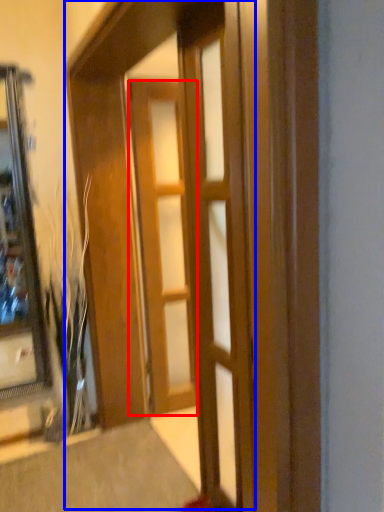
Question: Which object is closer to the camera taking this photo, door (highlighted by a red box) or barn door (highlighted by a blue box)?

Choices:
 (A) door
 (B) barn door

Answer: (B)